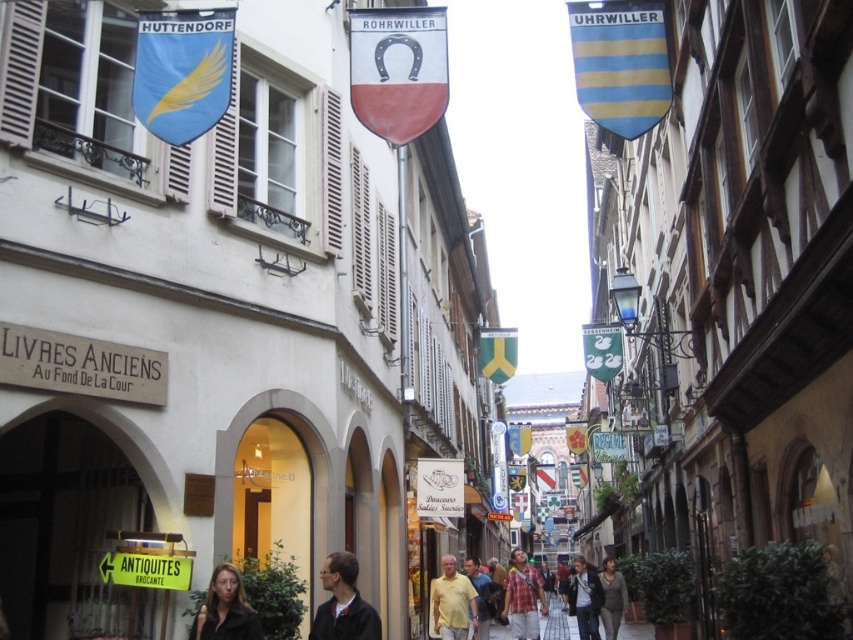
Question: Is blue fabric flag with golden feather at upper left positioned behind yellow matte shirt at center?

Choices:
 (A) no
 (B) yes

Answer: (A)

Question: Is white fabric flag at center closer to the viewer compared to plaid shirt at center?

Choices:
 (A) yes
 (B) no

Answer: (A)

Question: Which is nearer to the yellow fabric flag at center?

Choices:
 (A) blue striped shield at upper right
 (B) white fabric flag at center
 (C) dark gray jacket at center
 (D) matte black jacket at lower center

Answer: (A)

Question: Which of the following is the farthest from the observer?

Choices:
 (A) white fabric flag at center
 (B) dark gray jacket at center
 (C) yellow matte shirt at center

Answer: (C)

Question: Which object is the farthest from the yellow matte shirt at center?

Choices:
 (A) white fabric flag at center
 (B) dark gray jacket at center

Answer: (A)

Question: Does plaid shirt at center appear on the right side of green fabric swan at center?

Choices:
 (A) no
 (B) yes

Answer: (A)